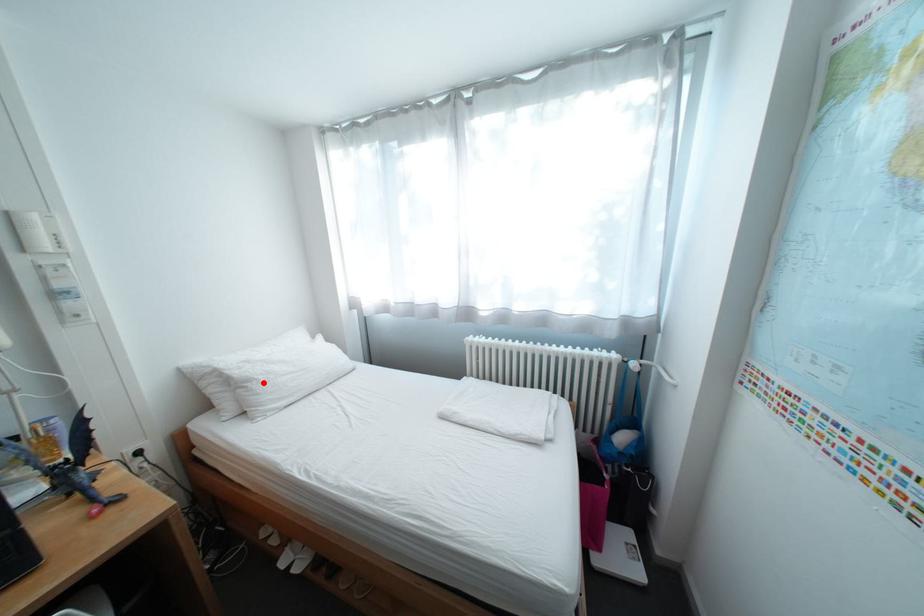
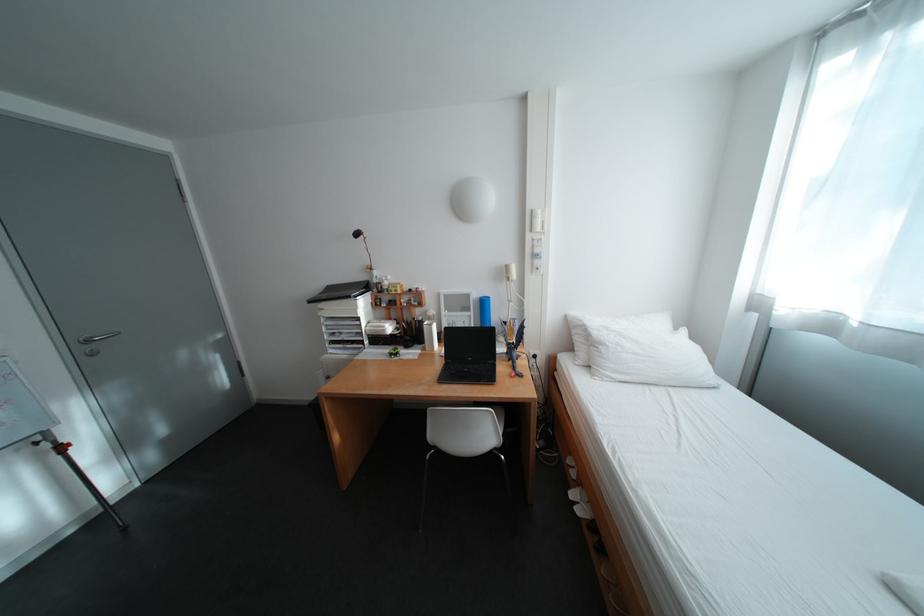
Where in the second image is the point corresponding to the highlighted location from the first image?

(614, 346)